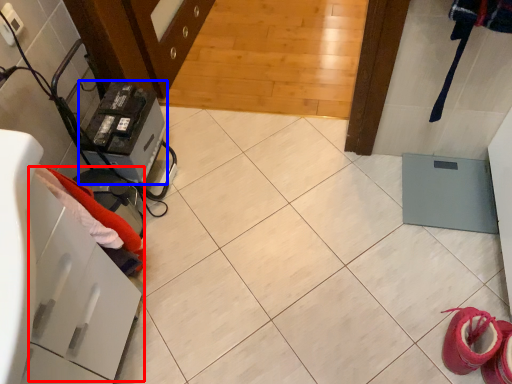
Question: Which of the following is the farthest to the observer, drawer (highlighted by a red box) or appliance (highlighted by a blue box)?

Choices:
 (A) drawer
 (B) appliance

Answer: (B)